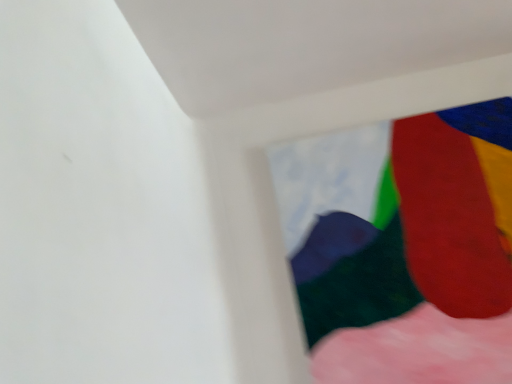
Describe the element at coordinates (404, 246) in the screenshot. Image resolution: width=512 pixels, height=384 pixels. I see `textured fabric flag at upper right` at that location.

Locate an element on the screen. This screenshot has height=384, width=512. textured fabric flag at upper right is located at coordinates (404, 246).

Locate an element on the screen. textured fabric flag at upper right is located at coordinates (404, 246).